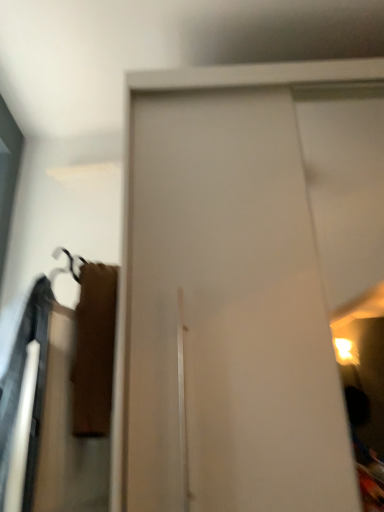
Question: Should I look upward or downward to see white glossy door at center?

Choices:
 (A) up
 (B) down

Answer: (B)

Question: Considering the relative sizes of white glossy door at center and velvet brown robe at left in the image provided, is white glossy door at center taller than velvet brown robe at left?

Choices:
 (A) yes
 (B) no

Answer: (A)

Question: Does white glossy door at center appear on the right side of velvet brown robe at left?

Choices:
 (A) no
 (B) yes

Answer: (B)

Question: Does white glossy door at center have a larger size compared to velvet brown robe at left?

Choices:
 (A) no
 (B) yes

Answer: (B)

Question: Is the depth of white glossy door at center less than that of velvet brown robe at left?

Choices:
 (A) no
 (B) yes

Answer: (B)

Question: Does white glossy door at center have a lesser width compared to velvet brown robe at left?

Choices:
 (A) yes
 (B) no

Answer: (B)

Question: Does white glossy door at center lie behind velvet brown robe at left?

Choices:
 (A) yes
 (B) no

Answer: (B)

Question: Is velvet brown robe at left turned away from white glossy door at center?

Choices:
 (A) yes
 (B) no

Answer: (B)

Question: Can you confirm if velvet brown robe at left is wider than white glossy door at center?

Choices:
 (A) yes
 (B) no

Answer: (B)

Question: Considering the relative positions of velvet brown robe at left and white glossy door at center in the image provided, is velvet brown robe at left behind white glossy door at center?

Choices:
 (A) no
 (B) yes

Answer: (B)

Question: From the image's perspective, is velvet brown robe at left on white glossy door at center?

Choices:
 (A) no
 (B) yes

Answer: (A)

Question: From a real-world perspective, is velvet brown robe at left positioned over white glossy door at center based on gravity?

Choices:
 (A) no
 (B) yes

Answer: (A)

Question: Is velvet brown robe at left closer to camera compared to white glossy door at center?

Choices:
 (A) no
 (B) yes

Answer: (A)

Question: Considering the positions of white glossy door at center and velvet brown robe at left in the image, is white glossy door at center taller or shorter than velvet brown robe at left?

Choices:
 (A) short
 (B) tall

Answer: (B)